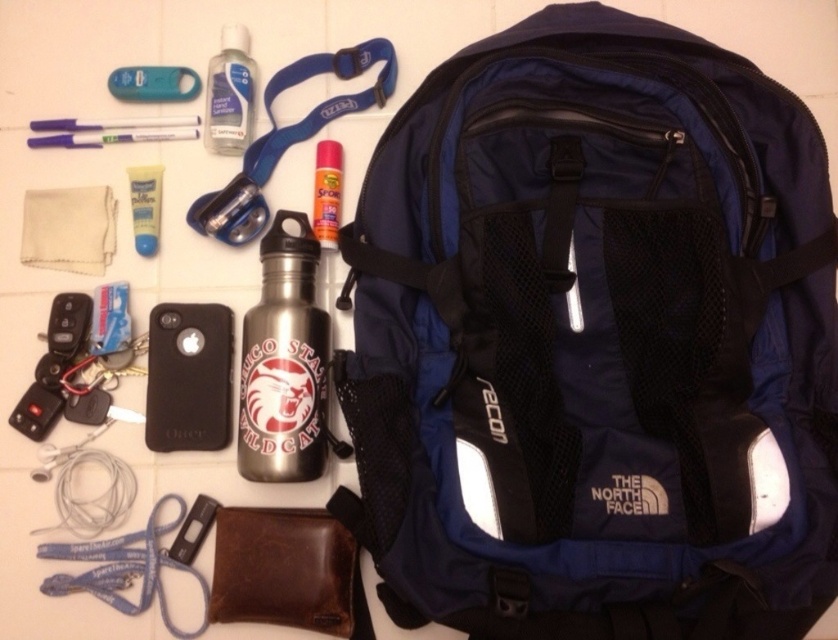
What is the spatial relationship between the blue backpack on the right and the black rubber phone case at lower left?

The black rubber phone case at lower left is located at point (189, 378), which is to the lower left of the blue backpack on the right.

You are organizing items on a table and need to place a new item between the metallic silver spray can at center and the black plastic usb drive at lower left. Where should you place it?

You should place the new item between the metallic silver spray can at center and the black plastic usb drive at lower left, positioning it either above the black plastic usb drive at lower left or below the metallic silver spray can at center since the spray can is above the USB drive.